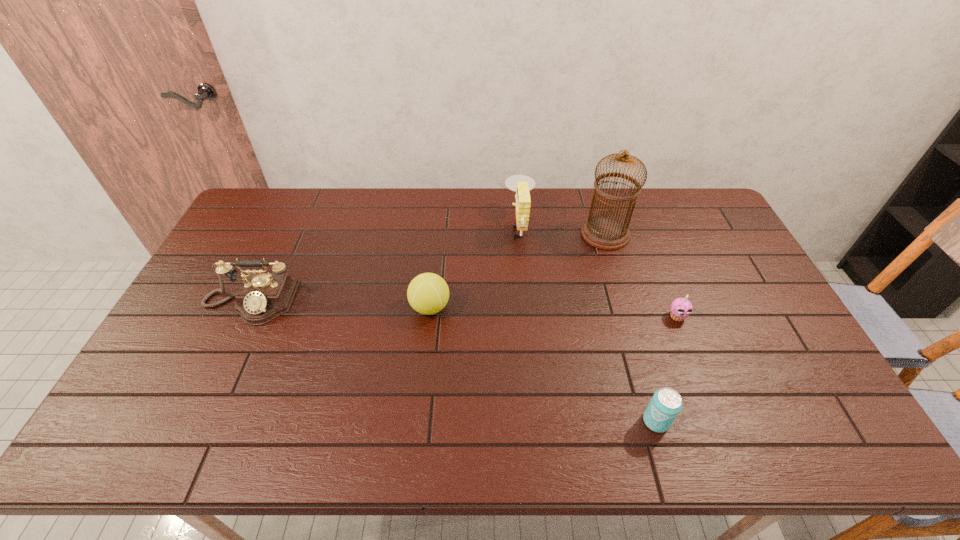
Image resolution: width=960 pixels, height=540 pixels. In order to click on object that is at the left edge in this screenshot , I will do `click(262, 297)`.

Image resolution: width=960 pixels, height=540 pixels. In order to click on free space at the far edge in this screenshot , I will do `click(511, 214)`.

At what (x,y) coordinates should I click in order to perform the action: click on free space at the right edge of the desktop. Please return your answer as a coordinate pair (x, y). The width and height of the screenshot is (960, 540). Looking at the image, I should click on (699, 264).

The height and width of the screenshot is (540, 960). What are the coordinates of `free space that is in between the beer can and the tallest object` in the screenshot? It's located at (631, 328).

The height and width of the screenshot is (540, 960). Identify the location of unoccupied area between the telephone and the shortest object. (464, 309).

Locate an element on the screen. This screenshot has height=540, width=960. free space between the telephone and the beer can is located at coordinates (453, 362).

I want to click on empty location between the sponge and the cupcake, so click(598, 271).

Find the location of a particular element. The image size is (960, 540). free space that is in between the rightmost object and the birdcage is located at coordinates (641, 275).

Image resolution: width=960 pixels, height=540 pixels. In order to click on empty space that is in between the leftmost object and the shortest object in this screenshot , I will do `click(464, 309)`.

Find the location of a particular element. empty location between the rightmost object and the birdcage is located at coordinates (641, 275).